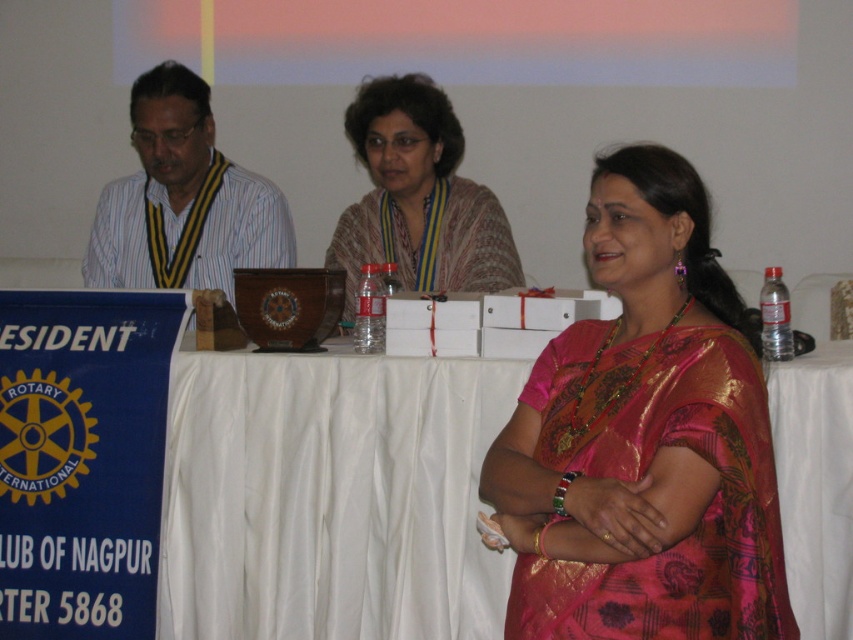
Question: Is pink silk saree at center to the right of striped shirt at left from the viewer's perspective?

Choices:
 (A) yes
 (B) no

Answer: (A)

Question: Is white cloth at center wider than striped shirt at left?

Choices:
 (A) no
 (B) yes

Answer: (B)

Question: Among these objects, which one is farthest from the camera?

Choices:
 (A) patterned fabric shawl at center
 (B) white cloth at center
 (C) striped shirt at left
 (D) pink silk saree at center

Answer: (C)

Question: Which point appears farthest from the camera in this image?

Choices:
 (A) (668, 333)
 (B) (346, 358)
 (C) (227, 173)

Answer: (C)

Question: Is pink silk saree at center further to camera compared to patterned fabric shawl at center?

Choices:
 (A) no
 (B) yes

Answer: (A)

Question: Which object is closer to the camera taking this photo?

Choices:
 (A) striped shirt at left
 (B) patterned fabric shawl at center
 (C) white cloth at center

Answer: (C)